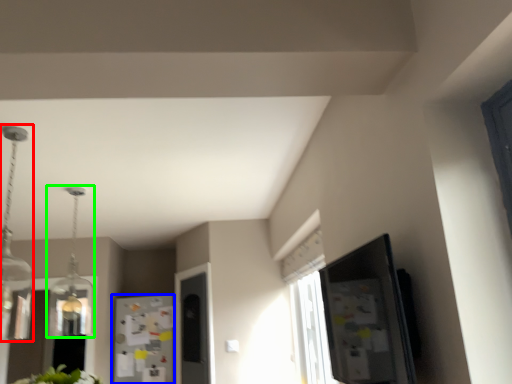
Question: Which object is positioned farthest from light fixture (highlighted by a red box)? Select from fridge (highlighted by a blue box) and light fixture (highlighted by a green box).

Choices:
 (A) fridge
 (B) light fixture

Answer: (A)